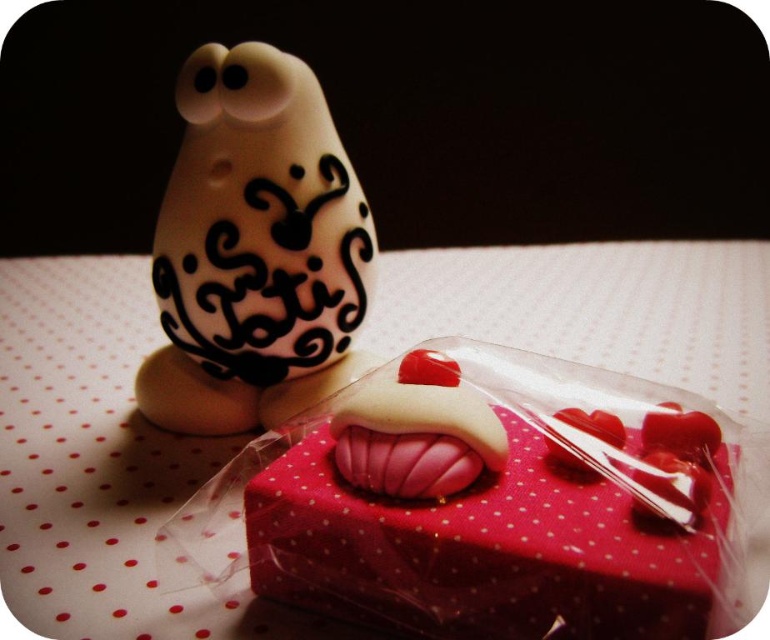
Question: Which point is farther from the camera taking this photo?

Choices:
 (A) (182, 177)
 (B) (658, 435)

Answer: (A)

Question: Does matte pink fabric box at center appear on the right side of white glossy figurine at upper left?

Choices:
 (A) yes
 (B) no

Answer: (A)

Question: Which point is closer to the camera?

Choices:
 (A) white glossy figurine at upper left
 (B) matte pink fabric box at center

Answer: (B)

Question: Which point appears closest to the camera in this image?

Choices:
 (A) (223, 294)
 (B) (584, 380)

Answer: (B)

Question: Can you confirm if matte pink fabric box at center is positioned to the right of white glossy figurine at upper left?

Choices:
 (A) yes
 (B) no

Answer: (A)

Question: Is matte pink fabric box at center to the right of white glossy figurine at upper left from the viewer's perspective?

Choices:
 (A) no
 (B) yes

Answer: (B)